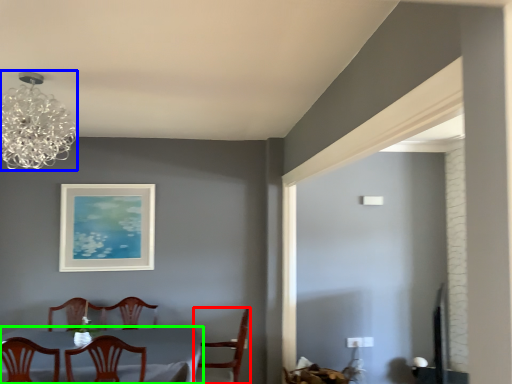
Question: Considering the real-world distances, which object is closest to chair (highlighted by a red box)? lamp (highlighted by a blue box) or table (highlighted by a green box).

Choices:
 (A) lamp
 (B) table

Answer: (B)